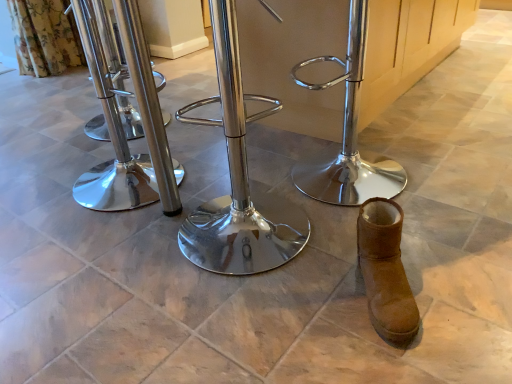
At what (x,y) coordinates should I click in order to perform the action: click on vacant space that is in between polished metal swivel chair at center, marked as the 3th swivel chair in a right-to-left arrangement, and polished metal swivel chair at center, which appears as the 2th swivel chair when viewed from the left. Please return your answer as a coordinate pair (x, y). This screenshot has height=384, width=512. Looking at the image, I should click on (175, 210).